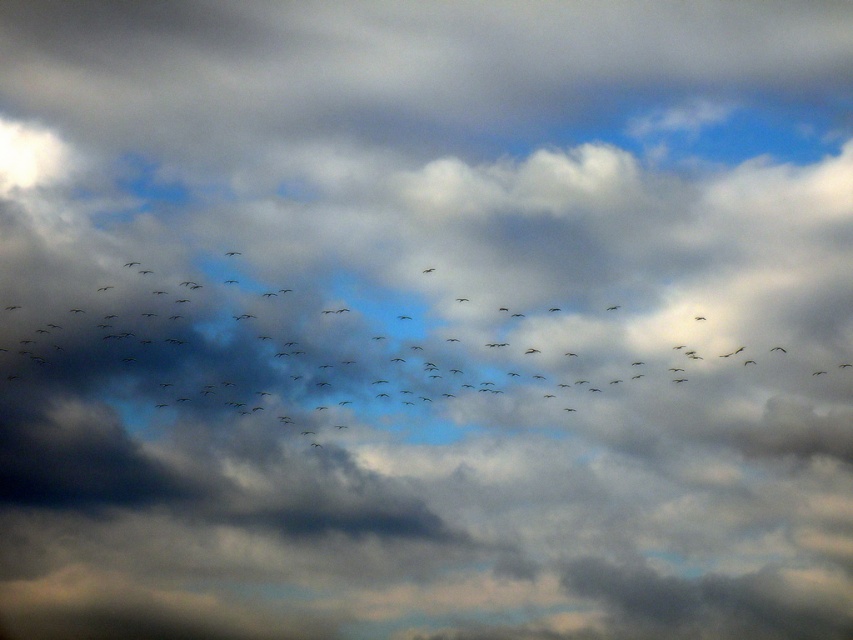
Between black matte birds at center and dark gray feathered bird at center, which one appears on the right side from the viewer's perspective?

Positioned to the right is dark gray feathered bird at center.

Which of these two, black matte birds at center or dark gray feathered bird at center, stands shorter?

With less height is dark gray feathered bird at center.

Who is more distant from viewer, (x=515, y=166) or (x=422, y=273)?

The point (x=515, y=166) is behind.

The width and height of the screenshot is (853, 640). I want to click on black matte birds at center, so pos(428,348).